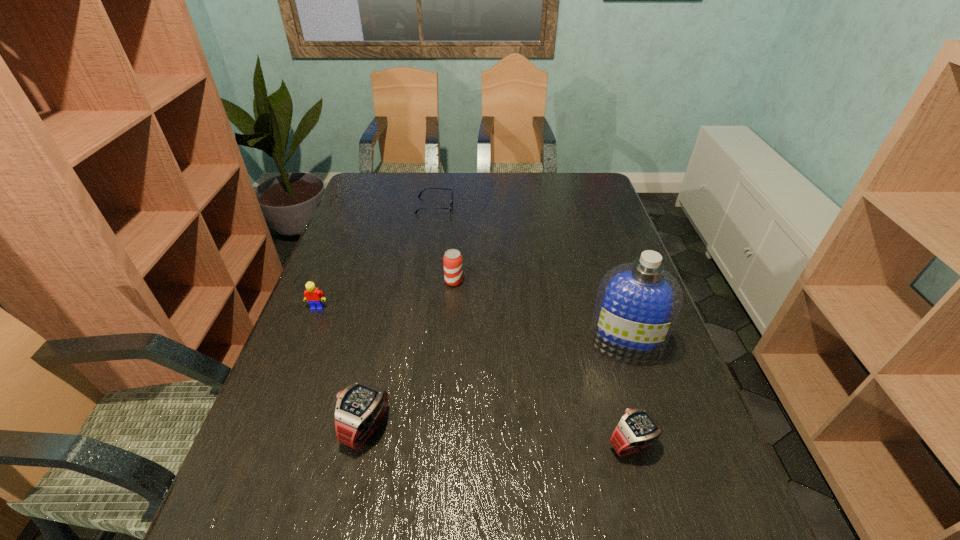
You are a GUI agent. You are given a task and a screenshot of the screen. Output one action in this format:
    pyautogui.click(x=<x>, y=<y>)
    Task: Click on the vacant area that lies between the cleansing agent and the taller watch
    
    Given the screenshot: What is the action you would take?
    pyautogui.click(x=495, y=386)

This screenshot has height=540, width=960. Find the location of `free space between the taller watch and the cleansing agent`. free space between the taller watch and the cleansing agent is located at coordinates (495, 386).

This screenshot has height=540, width=960. In order to click on free point between the fourth farthest object and the third farthest object in this screenshot , I will do `click(471, 326)`.

I want to click on vacant space that is in between the beer can and the right watch, so click(542, 363).

Where is `vacant space that is in between the shortest object and the fifth nearest object`? The height and width of the screenshot is (540, 960). vacant space that is in between the shortest object and the fifth nearest object is located at coordinates (444, 244).

Identify the location of free space between the shortest object and the fifth nearest object. This screenshot has width=960, height=540. (444, 244).

Where is `object that is the second closest to the right watch`? object that is the second closest to the right watch is located at coordinates (360, 407).

The image size is (960, 540). I want to click on object that ranks as the second closest to the spectacles, so click(x=313, y=295).

The width and height of the screenshot is (960, 540). Find the location of `vacant space that satisfies the following two spatial constraints: 1. on the front-facing side of the right watch; 2. on the right side of the Lego`. vacant space that satisfies the following two spatial constraints: 1. on the front-facing side of the right watch; 2. on the right side of the Lego is located at coordinates (264, 444).

Locate an element on the screen. Image resolution: width=960 pixels, height=540 pixels. vacant space that satisfies the following two spatial constraints: 1. on the front-facing side of the cleansing agent; 2. on the right side of the Lego is located at coordinates (303, 343).